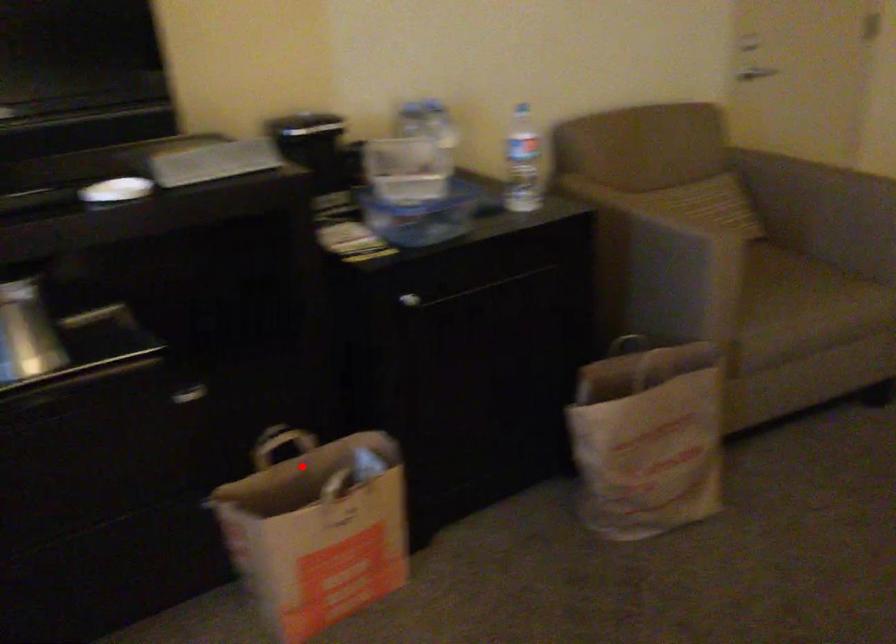
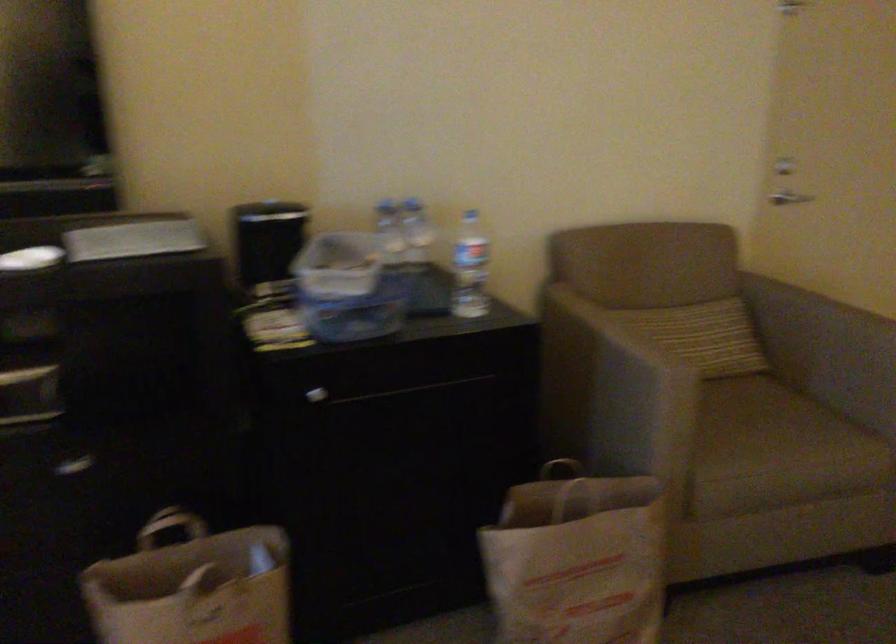
In the second image, find the point that corresponds to the highlighted location in the first image.

(192, 554)